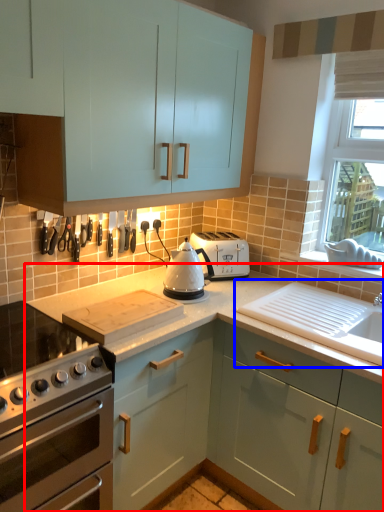
Question: Among these objects, which one is nearest to the camera, countertop (highlighted by a red box) or sink (highlighted by a blue box)?

Choices:
 (A) countertop
 (B) sink

Answer: (A)